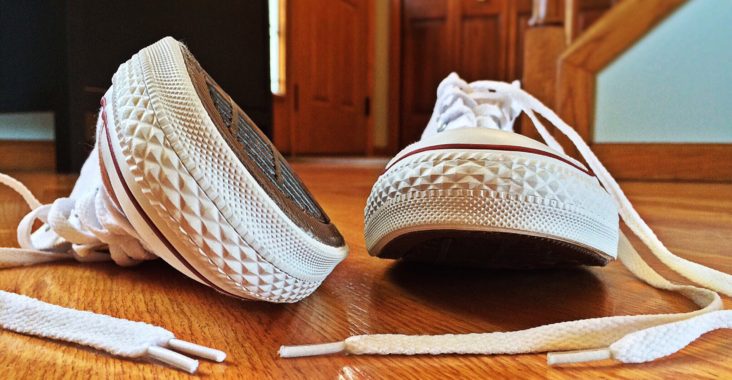
Where is `floor`? The height and width of the screenshot is (380, 732). floor is located at coordinates (350, 311).